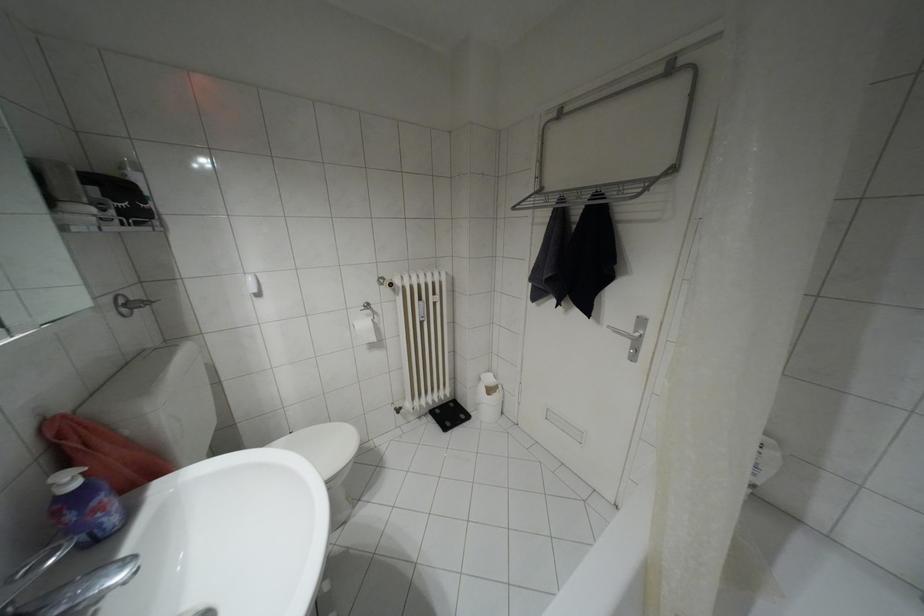
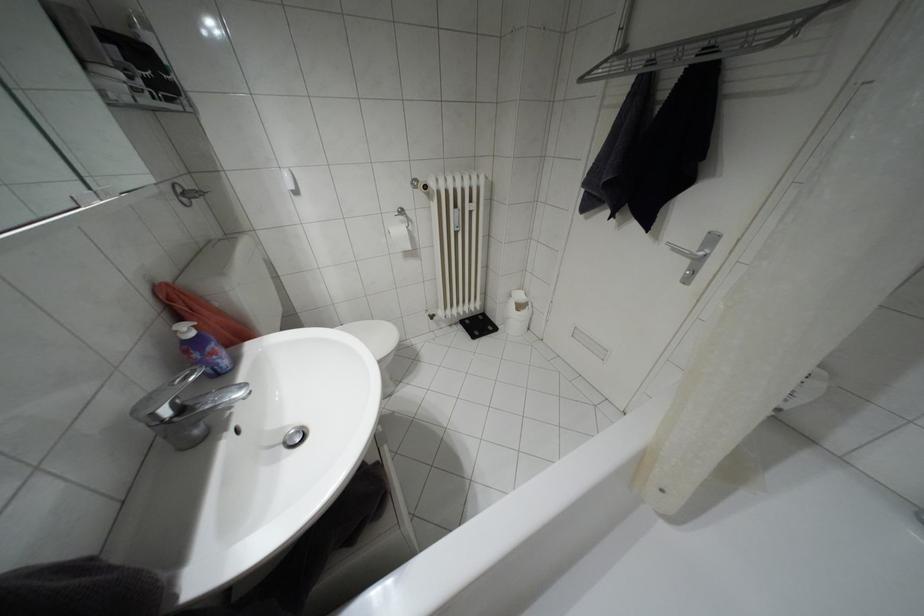
Find the pixel in the second image that matches pixel 614 331 in the first image.

(675, 249)